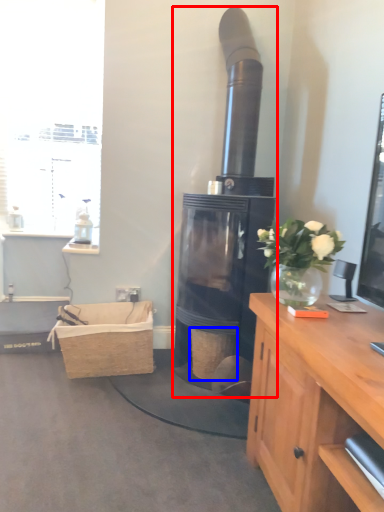
Question: Which object appears farthest to the camera in this image, fireplace (highlighted by a red box) or basket (highlighted by a blue box)?

Choices:
 (A) fireplace
 (B) basket

Answer: (B)